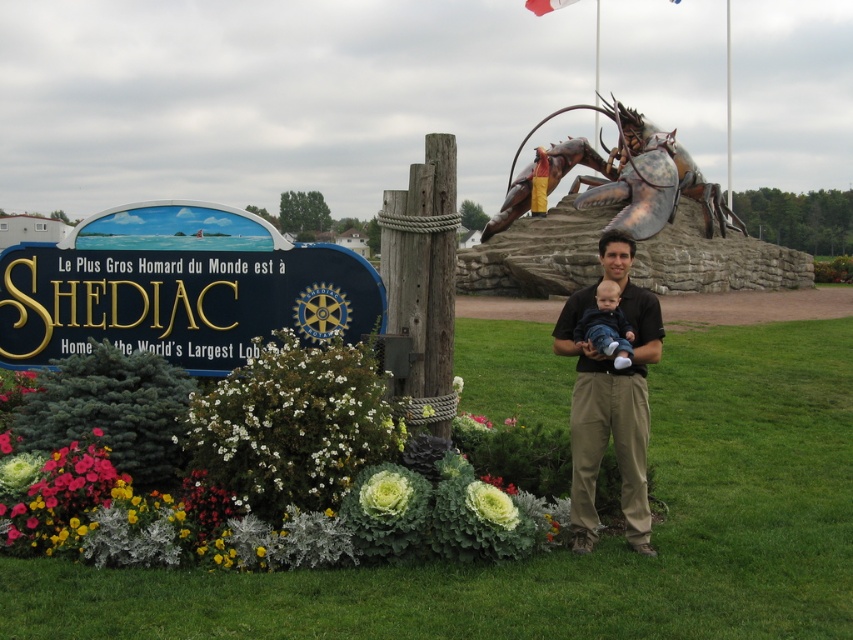
In the scene shown: You are a tourist visiting the site of the World Largest Lobster. You see a soft white fabric baby at center and a white leafy at lower center. Which object is closer to you?

The soft white fabric baby at center is closer to you because it is positioned over the white leafy at lower center, meaning it is in front of it from your perspective.

You are standing in front of the lobster sculpture and notice two points marked on the ground. One is at coordinate point (519, 209) and the other at point (517, 513). If you want to touch both points starting from your current position, which point should you reach first?

You should reach point (519, 209) first because it is closer to you than point (517, 513), as it is further away.